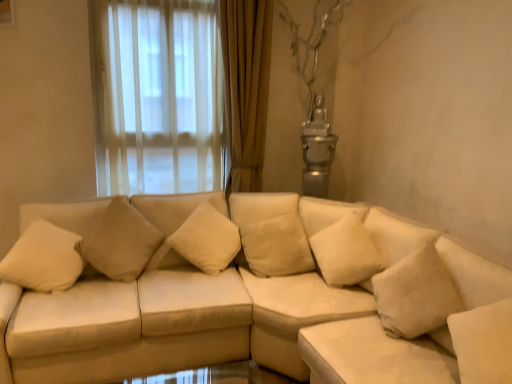
This screenshot has height=384, width=512. Identify the location of beige leather couch at center. (251, 293).

Where is `beige fabric pillow at center, positioned as the first pillow in right-to-left order`? This screenshot has height=384, width=512. beige fabric pillow at center, positioned as the first pillow in right-to-left order is located at coordinates (276, 246).

How many degrees apart are the facing directions of beige fabric pillow at center, which is the 2th pillow from left to right, and beige fabric pillow at center, which is the second pillow from right to left?

There is a 30.6-degree angle between the facing directions of beige fabric pillow at center, which is the 2th pillow from left to right, and beige fabric pillow at center, which is the second pillow from right to left.

From the image's perspective, which object appears higher, beige fabric pillow at center, which is the 2th pillow from left to right, or beige fabric pillow at center, which is the second pillow from right to left?

beige fabric pillow at center, which is the second pillow from right to left.

Is beige fabric pillow at center, which is the 2th pillow from left to right, oriented away from beige fabric pillow at center, which is the second pillow from right to left?

No, beige fabric pillow at center, which is the 2th pillow from left to right,'s orientation is not away from beige fabric pillow at center, which is the second pillow from right to left.

Based on the photo, between beige fabric pillow at center, positioned as the first pillow in right-to-left order, and beige fabric pillow at center, arranged as the 1th pillow when viewed from the left, which one has less height?

beige fabric pillow at center, positioned as the first pillow in right-to-left order.

Visually, is beige fabric pillow at center, arranged as the 1th pillow when viewed from the left, positioned to the left or to the right of beige leather couch at center?

Based on their positions, beige fabric pillow at center, arranged as the 1th pillow when viewed from the left, is located to the left of beige leather couch at center.

From the image's perspective, is beige fabric pillow at center, arranged as the 1th pillow when viewed from the left, located beneath beige leather couch at center?

Actually, beige fabric pillow at center, arranged as the 1th pillow when viewed from the left, appears above beige leather couch at center in the image.

Are beige fabric pillow at center, arranged as the 1th pillow when viewed from the left, and beige leather couch at center far apart?

beige fabric pillow at center, arranged as the 1th pillow when viewed from the left, is actually quite close to beige leather couch at center.

Find the location of a particular element. The width and height of the screenshot is (512, 384). pillow on the left side of beige leather couch at center is located at coordinates (120, 241).

Which object is further away from the camera taking this photo, beige fabric pillow at center, positioned as the first pillow in right-to-left order, or beige leather couch at center?

beige fabric pillow at center, positioned as the first pillow in right-to-left order, is further from the camera.

Can you tell me how much beige fabric pillow at center, positioned as the first pillow in right-to-left order, and beige leather couch at center differ in facing direction?

20.9 degrees.

Considering the relative positions of beige fabric pillow at center, positioned as the first pillow in right-to-left order, and beige leather couch at center in the image provided, is beige fabric pillow at center, positioned as the first pillow in right-to-left order, to the left of beige leather couch at center from the viewer's perspective?

Incorrect, beige fabric pillow at center, positioned as the first pillow in right-to-left order, is not on the left side of beige leather couch at center.

Find the location of a particular element. The height and width of the screenshot is (384, 512). studio couch located underneath the beige fabric pillow at center, positioned as the first pillow in right-to-left order (from a real-world perspective) is located at coordinates (251, 293).

Are beige leather couch at center and beige fabric pillow at center, positioned as the first pillow in right-to-left order, beside each other?

No, beige leather couch at center is not in contact with beige fabric pillow at center, positioned as the first pillow in right-to-left order.

Does beige leather couch at center have a greater width compared to beige fabric pillow at center, positioned as the first pillow in right-to-left order?

Correct, the width of beige leather couch at center exceeds that of beige fabric pillow at center, positioned as the first pillow in right-to-left order.

In the scene shown: From the image's perspective, would you say beige leather couch at center is positioned over beige fabric pillow at center, which is the 2th pillow from left to right?

No.

From the image's perspective, is beige fabric pillow at center, which is the second pillow from right to left, on top of beige fabric pillow at center, positioned as the first pillow in right-to-left order?

Correct, beige fabric pillow at center, which is the second pillow from right to left, appears higher than beige fabric pillow at center, positioned as the first pillow in right-to-left order, in the image.

Does point (114, 247) come behind point (261, 226)?

No, (114, 247) is in front of (261, 226).

In the scene shown: Considering the relative sizes of beige fabric pillow at center, arranged as the 1th pillow when viewed from the left, and beige fabric pillow at center, positioned as the first pillow in right-to-left order, in the image provided, is beige fabric pillow at center, arranged as the 1th pillow when viewed from the left, smaller than beige fabric pillow at center, positioned as the first pillow in right-to-left order,?

Correct, beige fabric pillow at center, arranged as the 1th pillow when viewed from the left, occupies less space than beige fabric pillow at center, positioned as the first pillow in right-to-left order.

Is beige fabric pillow at center, which is the second pillow from right to left, facing away from beige fabric pillow at center, positioned as the first pillow in right-to-left order?

No, beige fabric pillow at center, which is the second pillow from right to left,'s orientation is not away from beige fabric pillow at center, positioned as the first pillow in right-to-left order.

Is beige leather couch at center spatially inside beige fabric pillow at center, arranged as the 1th pillow when viewed from the left, or outside of it?

beige leather couch at center is outside beige fabric pillow at center, arranged as the 1th pillow when viewed from the left.

Are beige leather couch at center and beige fabric pillow at center, which is the second pillow from right to left, far apart?

No, beige leather couch at center is in close proximity to beige fabric pillow at center, which is the second pillow from right to left.

Between beige leather couch at center and beige fabric pillow at center, which is the second pillow from right to left, which one appears on the left side from the viewer's perspective?

beige fabric pillow at center, which is the second pillow from right to left, is more to the left.

The image size is (512, 384). What are the coordinates of `pillow on the left of the beige fabric pillow at center, positioned as the first pillow in right-to-left order` in the screenshot? It's located at (120, 241).

Image resolution: width=512 pixels, height=384 pixels. Identify the location of studio couch on the right of beige fabric pillow at center, which is the second pillow from right to left. (251, 293).

Estimate the real-world distances between objects in this image. Which object is further from beige fabric pillow at center, positioned as the first pillow in right-to-left order, beige leather couch at center or beige fabric pillow at center, arranged as the 1th pillow when viewed from the left?

beige fabric pillow at center, arranged as the 1th pillow when viewed from the left.

Considering their positions, is beige leather couch at center positioned further to beige fabric pillow at center, arranged as the 1th pillow when viewed from the left, than beige fabric pillow at center, positioned as the first pillow in right-to-left order?

Among the two, beige fabric pillow at center, positioned as the first pillow in right-to-left order, is located further to beige fabric pillow at center, arranged as the 1th pillow when viewed from the left.

When comparing their distances from beige fabric pillow at center, which is the 2th pillow from left to right, does beige fabric pillow at center, which is the second pillow from right to left, or beige leather couch at center seem further?

The object further to beige fabric pillow at center, which is the 2th pillow from left to right, is beige fabric pillow at center, which is the second pillow from right to left.

Based on the photo, looking at the image, which one is located further to beige fabric pillow at center, arranged as the 1th pillow when viewed from the left, beige fabric pillow at center, positioned as the first pillow in right-to-left order, or beige leather couch at center?

beige fabric pillow at center, positioned as the first pillow in right-to-left order, is further to beige fabric pillow at center, arranged as the 1th pillow when viewed from the left.

Considering their positions, is beige fabric pillow at center, which is the 2th pillow from left to right, positioned further to beige leather couch at center than beige fabric pillow at center, which is the second pillow from right to left?

beige fabric pillow at center, which is the second pillow from right to left.

Considering their positions, is beige fabric pillow at center, arranged as the 1th pillow when viewed from the left, positioned closer to beige leather couch at center than beige fabric pillow at center, which is the 2th pillow from left to right?

beige fabric pillow at center, which is the 2th pillow from left to right, lies closer to beige leather couch at center than the other object.

The width and height of the screenshot is (512, 384). I want to click on studio couch between beige fabric pillow at center, which is the second pillow from right to left, and beige fabric pillow at center, which is the 2th pillow from left to right, in the horizontal direction, so click(x=251, y=293).